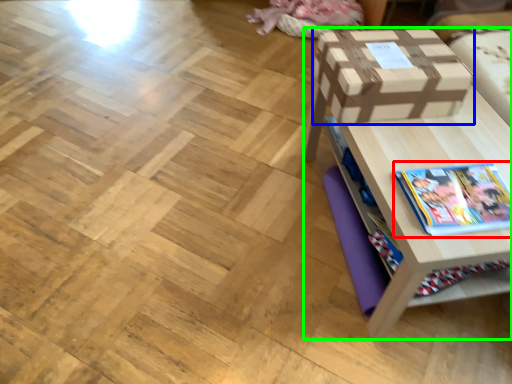
Question: Which object is the closest to the book (highlighted by a red box)? Choose among these: box (highlighted by a blue box) or table (highlighted by a green box).

Choices:
 (A) box
 (B) table

Answer: (B)